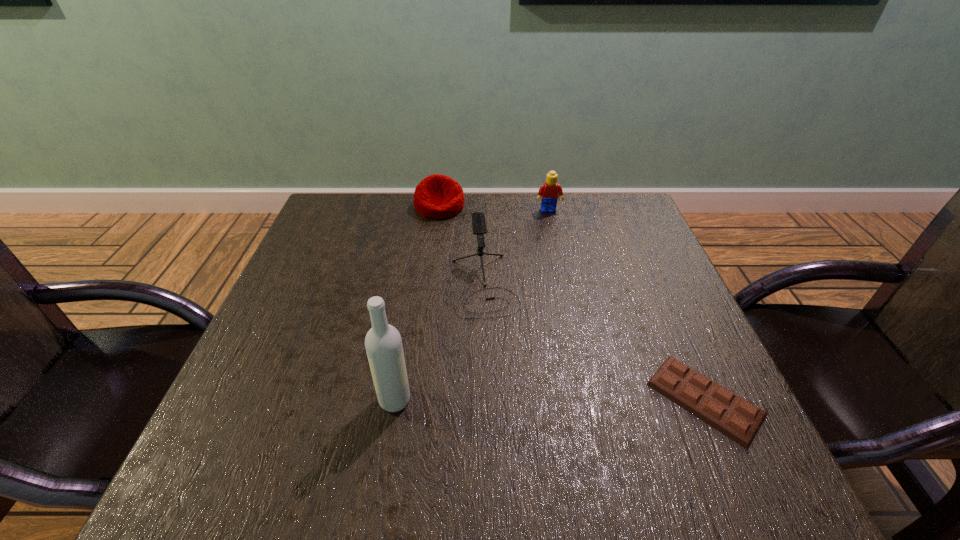
This screenshot has height=540, width=960. Identify the location of vodka. (383, 343).

The width and height of the screenshot is (960, 540). I want to click on chocolate bar, so click(x=730, y=414).

The width and height of the screenshot is (960, 540). Find the location of `the rightmost object`. the rightmost object is located at coordinates (730, 414).

Find the location of `microphone`. microphone is located at coordinates (479, 227).

Where is `beanbag`? This screenshot has width=960, height=540. beanbag is located at coordinates (437, 196).

Find the location of a particular element. This screenshot has height=540, width=960. Lego is located at coordinates (549, 191).

I want to click on vacant region located 0.260m on the back of the vodka, so 414,289.

At what (x,y) coordinates should I click in order to perform the action: click on vacant point located on the left of the rightmost object. Please return your answer as a coordinate pair (x, y). Looking at the image, I should click on (617, 399).

Locate an element on the screen. This screenshot has width=960, height=540. blank space located 0.110m on the stand of the microphone is located at coordinates (501, 360).

The width and height of the screenshot is (960, 540). In order to click on vacant area situated on the stand of the microphone in this screenshot , I will do `click(496, 341)`.